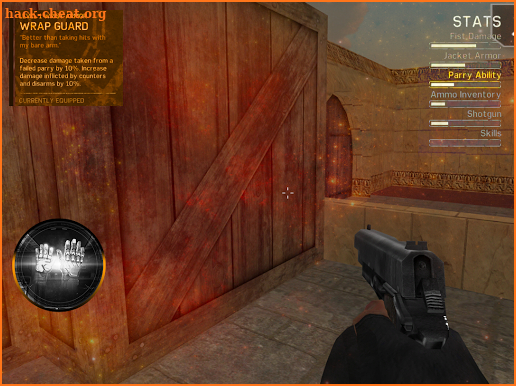
Find the location of a particular element. seat is located at coordinates (449, 204).